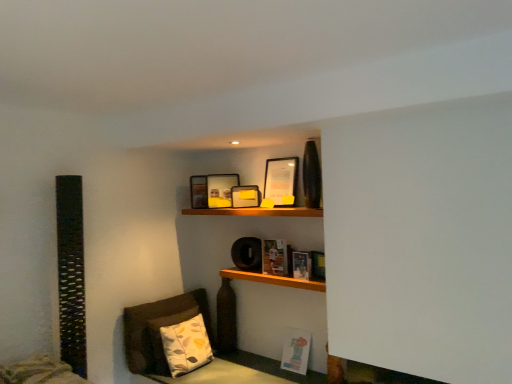
What are the coordinates of `printed fabric pillow at lower left` in the screenshot? It's located at (183, 343).

Identify the location of matte black picture frame at upper center, which is the 1th picture frame in back-to-front order. (198, 192).

Where is `wooden shelf at upper center, marked as the first shelf in a top-to-bottom arrangement`? The image size is (512, 384). wooden shelf at upper center, marked as the first shelf in a top-to-bottom arrangement is located at coordinates [258, 212].

Describe the element at coordinates (274, 257) in the screenshot. I see `matte paper book at center, which ranks as the 3th book in bottom-to-top order` at that location.

What is the approximate height of wooden shelf at center, which is counted as the second shelf, starting from the top?

wooden shelf at center, which is counted as the second shelf, starting from the top, is 2.44 inches in height.

You are a GUI agent. You are given a task and a screenshot of the screen. Output one action in this format:
    pyautogui.click(x=<x>, y=<y>)
    Task: Click on the hardcover book at center, arranged as the 2th book when ordered from the bottom
    
    Given the screenshot: What is the action you would take?
    pyautogui.click(x=301, y=265)

The height and width of the screenshot is (384, 512). I want to click on printed fabric pillow at lower left, so click(x=183, y=343).

How distant is matte paper book at center, the 1th book viewed from the top, from matte black picture frame at upper center, the second picture frame when ordered from front to back?

matte paper book at center, the 1th book viewed from the top, is 17.38 inches away from matte black picture frame at upper center, the second picture frame when ordered from front to back.

In the image, is matte paper book at center, the 1th book viewed from the top, positioned in front of or behind matte black picture frame at upper center, the second picture frame when ordered from front to back?

Visually, matte paper book at center, the 1th book viewed from the top, is located in front of matte black picture frame at upper center, the second picture frame when ordered from front to back.

Which object is thinner, matte paper book at center, the 1th book viewed from the top, or matte black picture frame at upper center, the second picture frame when ordered from front to back?

Thinner between the two is matte black picture frame at upper center, the second picture frame when ordered from front to back.

Would you say matte black picture frame at upper center, which is the fourth picture frame from back to front, is inside or outside wooden shelf at center, the 1th shelf ordered from the bottom?

matte black picture frame at upper center, which is the fourth picture frame from back to front, is spatially situated outside wooden shelf at center, the 1th shelf ordered from the bottom.

Which object is closer to the camera taking this photo, matte black picture frame at upper center, which is counted as the first picture frame, starting from the front, or wooden shelf at center, which is counted as the second shelf, starting from the top?

wooden shelf at center, which is counted as the second shelf, starting from the top, is in front.

From the image's perspective, between matte black picture frame at upper center, which is the fourth picture frame from back to front, and wooden shelf at center, which is counted as the second shelf, starting from the top, which one is located above?

matte black picture frame at upper center, which is the fourth picture frame from back to front, from the image's perspective.

From their relative heights in the image, would you say hardcover book at center, the second book when ordered from top to bottom, is taller or shorter than matte black picture frame at upper center, which is counted as the first picture frame, starting from the front?

Considering their sizes, hardcover book at center, the second book when ordered from top to bottom, has less height than matte black picture frame at upper center, which is counted as the first picture frame, starting from the front.

Considering the relative sizes of hardcover book at center, the second book when ordered from top to bottom, and matte black picture frame at upper center, which is the fourth picture frame from back to front, in the image provided, is hardcover book at center, the second book when ordered from top to bottom, wider than matte black picture frame at upper center, which is the fourth picture frame from back to front,?

No.

How distant is hardcover book at center, arranged as the 2th book when ordered from the bottom, from matte black picture frame at upper center, which is the fourth picture frame from back to front?

hardcover book at center, arranged as the 2th book when ordered from the bottom, and matte black picture frame at upper center, which is the fourth picture frame from back to front, are 61.68 centimeters apart from each other.

From the image's perspective, which is above, hardcover book at center, arranged as the 2th book when ordered from the bottom, or matte black picture frame at upper center, which is counted as the first picture frame, starting from the front?

matte black picture frame at upper center, which is counted as the first picture frame, starting from the front.

Is wooden shelf at upper center, marked as the first shelf in a top-to-bottom arrangement, situated inside matte black picture frame at upper center, which is the fourth picture frame from back to front, or outside?

wooden shelf at upper center, marked as the first shelf in a top-to-bottom arrangement, exists outside the volume of matte black picture frame at upper center, which is the fourth picture frame from back to front.

Between wooden shelf at upper center, marked as the first shelf in a top-to-bottom arrangement, and matte black picture frame at upper center, which is the fourth picture frame from back to front, which one has smaller size?

matte black picture frame at upper center, which is the fourth picture frame from back to front, is smaller.

From the picture: From the image's perspective, which one is positioned lower, wooden shelf at upper center, which is the second shelf from bottom to top, or matte black picture frame at upper center, which is the fourth picture frame from back to front?

wooden shelf at upper center, which is the second shelf from bottom to top, appears lower in the image.

From a real-world perspective, is wooden shelf at upper center, marked as the first shelf in a top-to-bottom arrangement, located beneath matte black picture frame at upper center, which is the fourth picture frame from back to front?

Yes, from a real-world perspective, wooden shelf at upper center, marked as the first shelf in a top-to-bottom arrangement, is beneath matte black picture frame at upper center, which is the fourth picture frame from back to front.

This screenshot has height=384, width=512. Identify the location of the 2nd picture frame to the left of the matte black picture frame at upper center, which is counted as the first picture frame, starting from the front, counting from the anchor's position. (221, 189).

Is matte yellow picture frame at upper center, marked as the second picture frame in a back-to-front arrangement, at the right side of matte black picture frame at upper center, which is the fourth picture frame from back to front?

No, matte yellow picture frame at upper center, marked as the second picture frame in a back-to-front arrangement, is not to the right of matte black picture frame at upper center, which is the fourth picture frame from back to front.

From the image's perspective, is matte yellow picture frame at upper center, the third picture frame in the front-to-back sequence, on matte black picture frame at upper center, which is the fourth picture frame from back to front?

Actually, matte yellow picture frame at upper center, the third picture frame in the front-to-back sequence, appears below matte black picture frame at upper center, which is the fourth picture frame from back to front, in the image.

Is matte yellow picture frame at upper center, marked as the second picture frame in a back-to-front arrangement, completely or partially outside of matte black picture frame at upper center, which is counted as the first picture frame, starting from the front?

Absolutely, matte yellow picture frame at upper center, marked as the second picture frame in a back-to-front arrangement, is external to matte black picture frame at upper center, which is counted as the first picture frame, starting from the front.

Is printed fabric pillow at lower left at the left side of matte paper book at center, which ranks as the 3th book in bottom-to-top order?

Yes, printed fabric pillow at lower left is to the left of matte paper book at center, which ranks as the 3th book in bottom-to-top order.

Is printed fabric pillow at lower left not close to matte paper book at center, the 1th book viewed from the top?

No, there isn't a large distance between printed fabric pillow at lower left and matte paper book at center, the 1th book viewed from the top.

Is printed fabric pillow at lower left taller or shorter than matte paper book at center, which ranks as the 3th book in bottom-to-top order?

Considering their sizes, printed fabric pillow at lower left has more height than matte paper book at center, which ranks as the 3th book in bottom-to-top order.

From the printed fabric pillow at lower left, count 1st book to the right and point to it. Please provide its 2D coordinates.

[(274, 257)]

Is point (283, 257) behind point (209, 179)?

That is False.

Measure the distance between matte paper book at center, the 1th book viewed from the top, and matte yellow picture frame at upper center, marked as the second picture frame in a back-to-front arrangement.

They are 24.11 inches apart.

Are matte paper book at center, the 1th book viewed from the top, and matte yellow picture frame at upper center, marked as the second picture frame in a back-to-front arrangement, far apart?

They are positioned close to each other.

Which is more to the left, matte paper book at center, which ranks as the 3th book in bottom-to-top order, or matte yellow picture frame at upper center, marked as the second picture frame in a back-to-front arrangement?

From the viewer's perspective, matte yellow picture frame at upper center, marked as the second picture frame in a back-to-front arrangement, appears more on the left side.

In order to click on picture frame that is the 2nd one when counting backward from the matte paper book at center, which ranks as the 3th book in bottom-to-top order in this screenshot , I will do `click(245, 196)`.

The height and width of the screenshot is (384, 512). I want to click on shelf located on the right of matte black picture frame at upper center, which is the fourth picture frame from back to front, so click(x=272, y=279).

Estimate the real-world distances between objects in this image. Which object is closer to matte paper book at center, the 1th book viewed from the top, matte black picture frame at upper center, which is counted as the first picture frame, starting from the front, or printed fabric pillow at lower left?

matte black picture frame at upper center, which is counted as the first picture frame, starting from the front, is positioned closer to the anchor matte paper book at center, the 1th book viewed from the top.

Based on their spatial positions, is hardcover book at center, arranged as the 2th book when ordered from the bottom, or matte paper book at center, which ranks as the 3th book in bottom-to-top order, further from matte black picture frame at upper center, which is the 1th picture frame in back-to-front order?

hardcover book at center, arranged as the 2th book when ordered from the bottom.

Considering their positions, is matte black picture frame at upper center, the second picture frame when ordered from front to back, positioned closer to matte paper book at lower right, placed as the 3th book when sorted from top to bottom, than matte black picture frame at upper center, which is the 1th picture frame in back-to-front order?

The object closer to matte paper book at lower right, placed as the 3th book when sorted from top to bottom, is matte black picture frame at upper center, the second picture frame when ordered from front to back.

Looking at the image, which one is located further to matte black picture frame at upper center, which is the 3th picture frame in back-to-front order, matte paper book at center, which ranks as the 3th book in bottom-to-top order, or wooden shelf at upper center, marked as the first shelf in a top-to-bottom arrangement?

matte paper book at center, which ranks as the 3th book in bottom-to-top order.

Which object lies nearer to the anchor point printed fabric pillow at lower left, matte black picture frame at upper center, which is the fourth picture frame from back to front, or wooden shelf at center, the 1th shelf ordered from the bottom?

wooden shelf at center, the 1th shelf ordered from the bottom, lies closer to printed fabric pillow at lower left than the other object.

Based on their spatial positions, is wooden shelf at upper center, marked as the first shelf in a top-to-bottom arrangement, or matte black picture frame at upper center, which is counted as the 4th picture frame, starting from the front, further from matte yellow picture frame at upper center, the third picture frame in the front-to-back sequence?

wooden shelf at upper center, marked as the first shelf in a top-to-bottom arrangement, is further to matte yellow picture frame at upper center, the third picture frame in the front-to-back sequence.

Considering their positions, is wooden shelf at upper center, which is the second shelf from bottom to top, positioned further to matte paper book at center, which ranks as the 3th book in bottom-to-top order, than wooden shelf at center, the 1th shelf ordered from the bottom?

Based on the image, wooden shelf at upper center, which is the second shelf from bottom to top, appears to be further to matte paper book at center, which ranks as the 3th book in bottom-to-top order.

Looking at the image, which one is located further to matte black picture frame at upper center, the second picture frame when ordered from front to back, printed fabric pillow at lower left or matte yellow picture frame at upper center, the third picture frame in the front-to-back sequence?

Among the two, printed fabric pillow at lower left is located further to matte black picture frame at upper center, the second picture frame when ordered from front to back.

Image resolution: width=512 pixels, height=384 pixels. Identify the location of pillow between matte black picture frame at upper center, which is the fourth picture frame from back to front, and matte paper book at lower right, placed as the 3th book when sorted from top to bottom, from top to bottom. (183, 343).

You are a GUI agent. You are given a task and a screenshot of the screen. Output one action in this format:
    pyautogui.click(x=<x>, y=<y>)
    Task: Click on the book between matte black picture frame at upper center, which is the 3th picture frame in back-to-front order, and hardcover book at center, arranged as the 2th book when ordered from the bottom, vertically
    
    Given the screenshot: What is the action you would take?
    pyautogui.click(x=274, y=257)

Image resolution: width=512 pixels, height=384 pixels. What are the coordinates of `shelf that lies between hardcover book at center, the second book when ordered from top to bottom, and matte paper book at lower right, the 1th book when ordered from bottom to top, from top to bottom` in the screenshot? It's located at click(x=272, y=279).

Identify the location of shelf between matte black picture frame at upper center, which is the fourth picture frame from back to front, and wooden shelf at center, which is counted as the second shelf, starting from the top, from top to bottom. (258, 212).